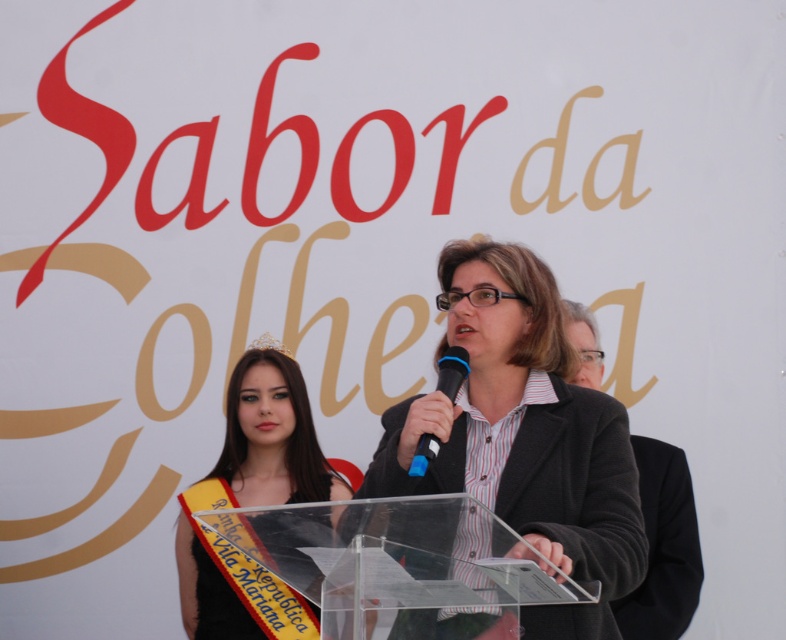
Between point (665, 458) and point (263, 340), which one is positioned behind?

The point (263, 340) is more distant.

Does black wool coat at center have a greater width compared to gold metallic tiara at upper center?

Yes.

This screenshot has width=786, height=640. Identify the location of black wool coat at center. (663, 547).

Find the location of a particular element. The width and height of the screenshot is (786, 640). black wool coat at center is located at coordinates (663, 547).

Is matte black jacket at center shorter than blue plastic microphone at center?

Incorrect, matte black jacket at center's height does not fall short of blue plastic microphone at center's.

Who is taller, matte black jacket at center or blue plastic microphone at center?

With more height is matte black jacket at center.

Describe the element at coordinates (524, 435) in the screenshot. This screenshot has height=640, width=786. I see `matte black jacket at center` at that location.

I want to click on matte black jacket at center, so (524, 435).

Can you confirm if black wool coat at center is shorter than blue plastic microphone at center?

No.

Is black wool coat at center positioned in front of blue plastic microphone at center?

No.

Find the location of `black wool coat at center`. black wool coat at center is located at coordinates (663, 547).